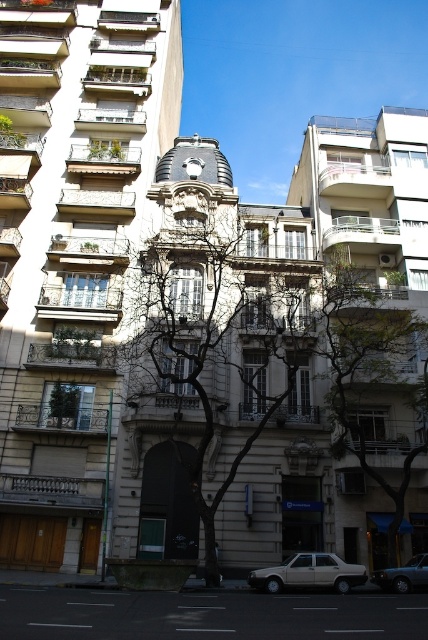
Question: Considering the real-world distances, which object is closest to the silver metallic sedan at center?

Choices:
 (A) beige matte sedan at lower center
 (B) bare branches at center

Answer: (A)

Question: From the image, what is the correct spatial relationship of green leafy tree at center in relation to silver metallic sedan at center?

Choices:
 (A) left
 (B) right

Answer: (B)

Question: Is bare branches at center positioned at the back of silver metallic sedan at center?

Choices:
 (A) yes
 (B) no

Answer: (B)

Question: Is green leafy tree at center thinner than silver metallic sedan at center?

Choices:
 (A) yes
 (B) no

Answer: (B)

Question: Which point is farther to the camera?

Choices:
 (A) silver metallic sedan at center
 (B) beige matte sedan at lower center
 (C) bare branches at center
 (D) green leafy tree at center

Answer: (D)

Question: Which point is farther to the camera?

Choices:
 (A) (190, 310)
 (B) (353, 358)
 (C) (407, 573)

Answer: (A)